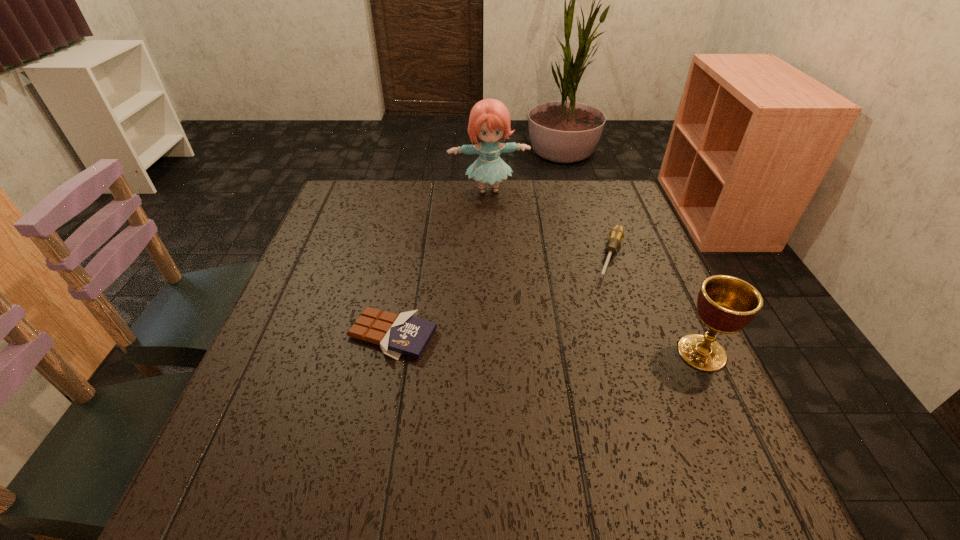
The image size is (960, 540). Identify the location of free spot at the left edge of the desktop. (362, 280).

Where is `vacant area at the right edge of the desktop`? This screenshot has height=540, width=960. vacant area at the right edge of the desktop is located at coordinates (678, 401).

Find the location of a particular element. The height and width of the screenshot is (540, 960). free spot at the near left corner of the desktop is located at coordinates (277, 422).

In the image, there is a desktop. At what (x,y) coordinates should I click in order to perform the action: click on vacant space at the far right corner. Please return your answer as a coordinate pair (x, y). The image size is (960, 540). Looking at the image, I should click on (608, 214).

Locate an element on the screen. The image size is (960, 540). empty location between the chalice and the screwdriver is located at coordinates (657, 305).

The image size is (960, 540). I want to click on free space between the second shortest object and the shortest object, so (x=502, y=296).

Find the location of `empty space between the second farthest object and the farthest object`. empty space between the second farthest object and the farthest object is located at coordinates (550, 224).

The image size is (960, 540). In order to click on free point between the chocolate bar and the third object from left to right in this screenshot , I will do `click(502, 296)`.

Where is `empty space that is in between the third nearest object and the rightmost object`? empty space that is in between the third nearest object and the rightmost object is located at coordinates (657, 305).

Where is `unoccupied area between the second tallest object and the shortest object`? The width and height of the screenshot is (960, 540). unoccupied area between the second tallest object and the shortest object is located at coordinates pos(547,343).